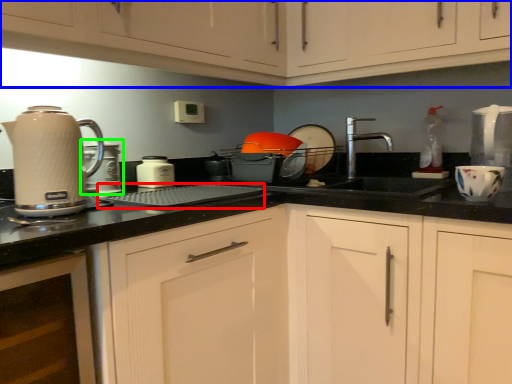
Question: Which object is positioned farthest from appliance (highlighted by a red box)? Select from cabinetry (highlighted by a blue box) and kitchen appliance (highlighted by a green box).

Choices:
 (A) cabinetry
 (B) kitchen appliance

Answer: (A)